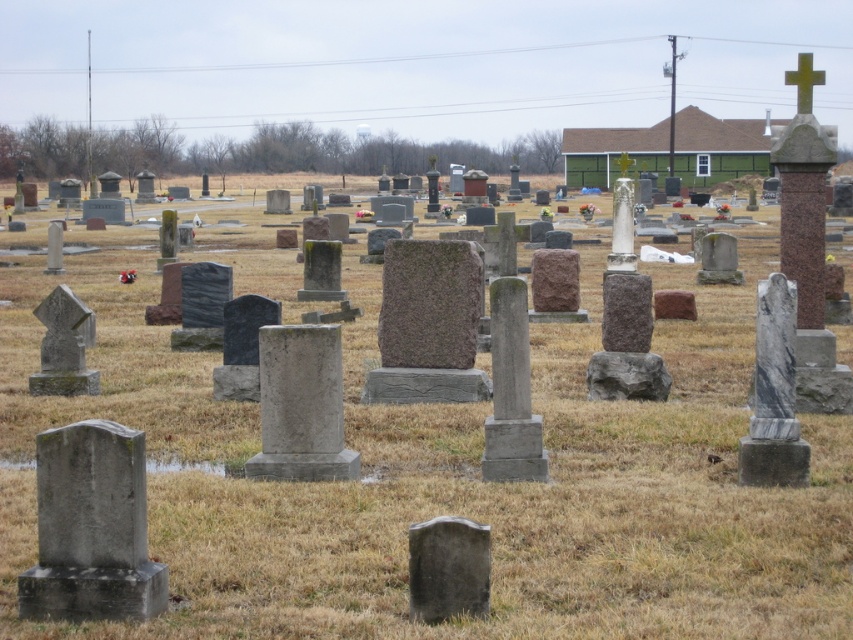
Question: Which point is farther from the camera taking this photo?

Choices:
 (A) (546, 595)
 (B) (786, 70)
 (C) (445, 520)

Answer: (B)

Question: Which point is closer to the camera taking this photo?

Choices:
 (A) (27, 412)
 (B) (819, 77)
 (C) (410, 557)

Answer: (C)

Question: Considering the relative positions of brown dry grass at center and green polished stone cross at upper right in the image provided, where is brown dry grass at center located with respect to green polished stone cross at upper right?

Choices:
 (A) below
 (B) above

Answer: (A)

Question: Is brown dry grass at center above smooth gray stone at center?

Choices:
 (A) yes
 (B) no

Answer: (A)

Question: Considering the relative positions of brown dry grass at center and green polished stone cross at upper right in the image provided, where is brown dry grass at center located with respect to green polished stone cross at upper right?

Choices:
 (A) right
 (B) left

Answer: (B)

Question: Which point is farther to the camera?

Choices:
 (A) green polished stone cross at upper right
 (B) brown dry grass at center
 (C) smooth gray stone at center

Answer: (A)